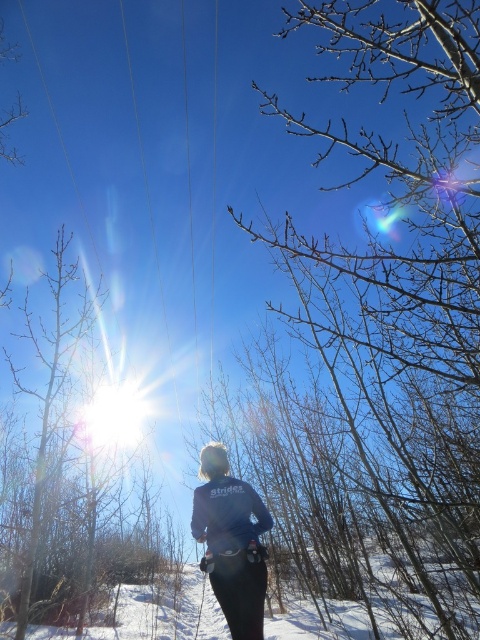
Question: Can you confirm if bare branches at center is smaller than dark blue fleece jacket at center?

Choices:
 (A) yes
 (B) no

Answer: (B)

Question: Is bare branches at center to the left of dark blue fleece jacket at center from the viewer's perspective?

Choices:
 (A) yes
 (B) no

Answer: (B)

Question: Which point is closer to the camera?

Choices:
 (A) coord(399,186)
 (B) coord(230,634)

Answer: (B)

Question: Does bare branches at center have a larger size compared to dark blue fleece jacket at center?

Choices:
 (A) yes
 (B) no

Answer: (A)

Question: Which of the following is the farthest from the observer?

Choices:
 (A) (225, 520)
 (B) (468, 413)

Answer: (B)